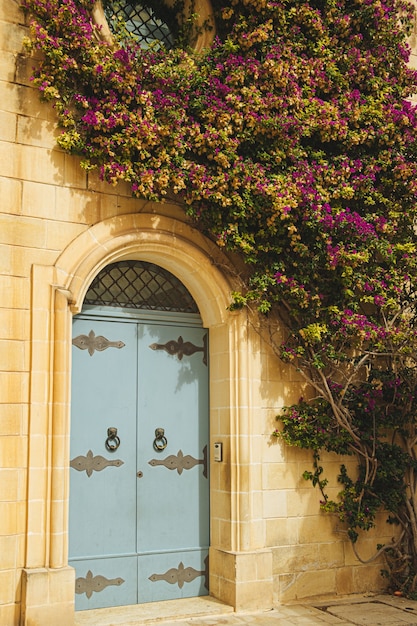
You are a GUI agent. You are given a task and a screenshot of the screen. Output one action in this format:
    pyautogui.click(x=<x>, y=<y>)
    Task: Click on the latice over doors
    
    Given the screenshot: What is the action you would take?
    pyautogui.click(x=139, y=285)